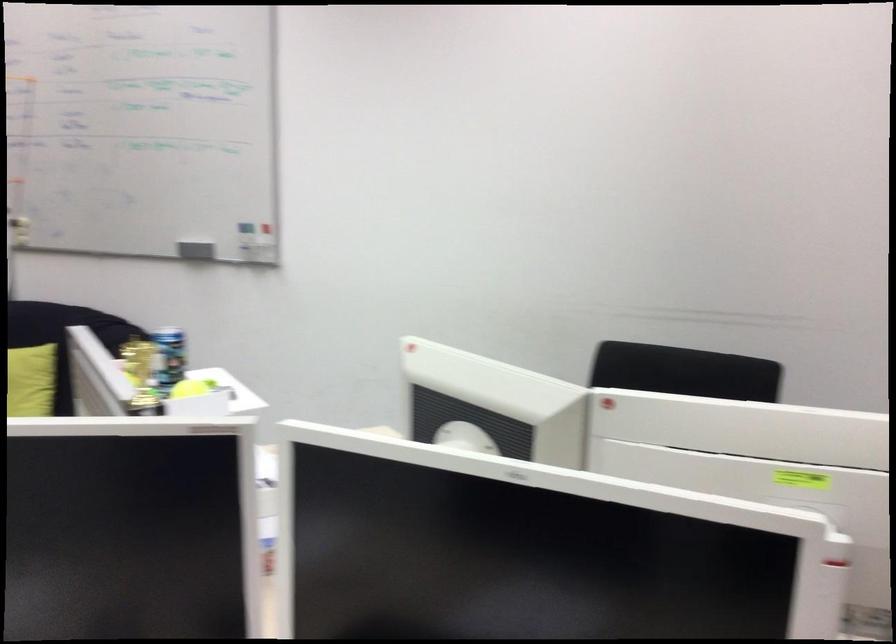
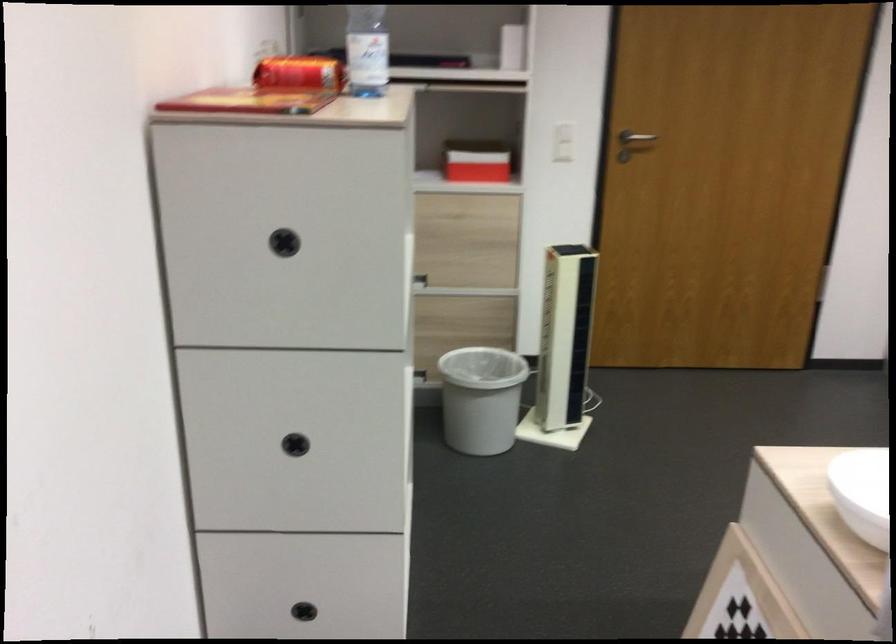
The first image is from the beginning of the video and the second image is from the end. How did the camera likely rotate when shooting the video?

The rotation direction of the camera is left-down.